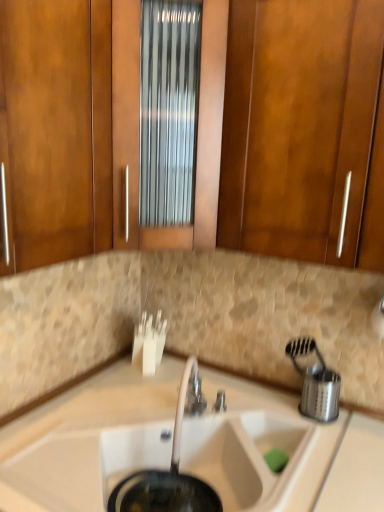
In order to click on empty space that is to the right of white ceramic faucet at center in this screenshot , I will do `click(254, 421)`.